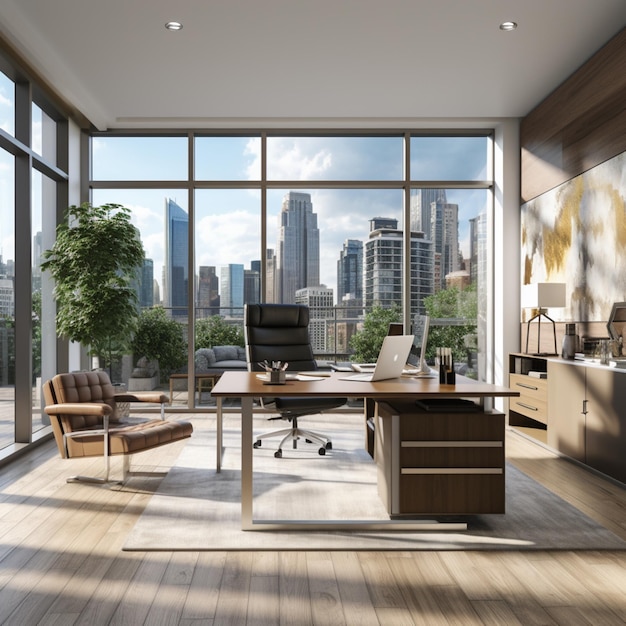
Locate an element on the screen. The image size is (626, 626). desk is located at coordinates (331, 384), (414, 382).